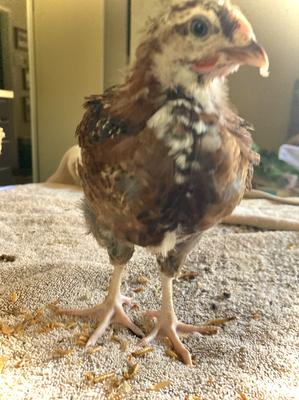
At what (x,y) coordinates should I click in order to perform the action: click on wall. Please return your answer as a coordinate pair (x, y). The width and height of the screenshot is (299, 400). Looking at the image, I should click on (78, 54), (265, 98), (16, 14).